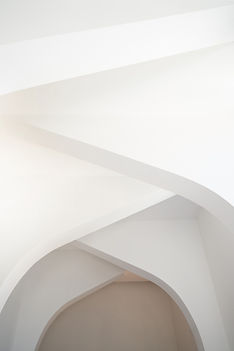
This screenshot has height=351, width=234. I want to click on angle of floor with back wall, so click(132, 281).